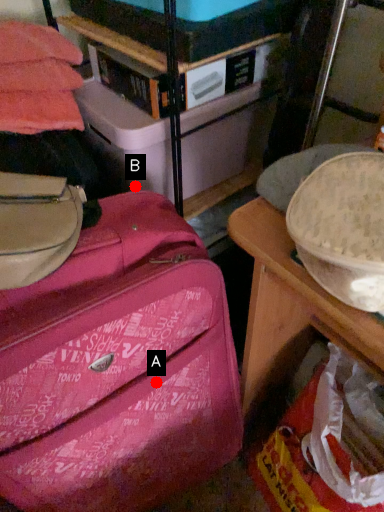
Question: Two points are circled on the image, labeled by A and B beside each circle. Which point is farther to the camera?

Choices:
 (A) A is further
 (B) B is further

Answer: (B)